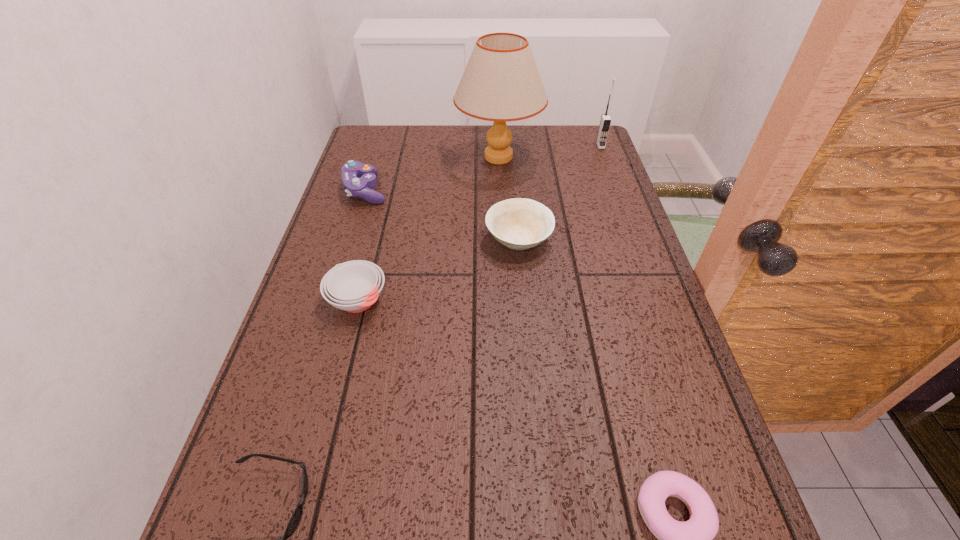
I want to click on the tallest object, so click(x=501, y=83).

Identify the location of cellular telephone. This screenshot has height=540, width=960. pyautogui.click(x=605, y=122).

At what (x,y) coordinates should I click in order to perform the action: click on the sixth shortest object. Please return your answer as a coordinate pair (x, y). Looking at the image, I should click on (605, 122).

This screenshot has width=960, height=540. I want to click on control, so click(x=354, y=186).

The width and height of the screenshot is (960, 540). Find the location of `bowl`. bowl is located at coordinates (518, 223).

The image size is (960, 540). I want to click on soup bowl, so click(x=354, y=286).

Locate an element on the screen. vacant space situated on the right of the tallest object is located at coordinates (597, 157).

Where is `free space located 0.280m on the front-facing side of the rightmost object`? free space located 0.280m on the front-facing side of the rightmost object is located at coordinates (620, 199).

You are a GUI agent. You are given a task and a screenshot of the screen. Output one action in this format:
    pyautogui.click(x=<x>, y=<y>)
    Task: Click on the vacant space positioned 0.200m on the right of the control
    This screenshot has height=540, width=960.
    Given the screenshot: What is the action you would take?
    [456, 190]

I want to click on vacant region located 0.090m on the right of the bowl, so click(587, 240).